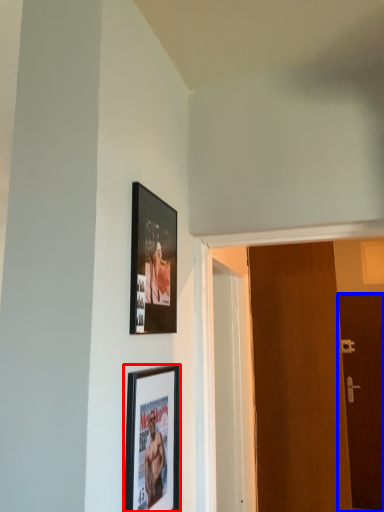
Question: Which of the following is the closest to the observer, picture frame (highlighted by a red box) or door (highlighted by a blue box)?

Choices:
 (A) picture frame
 (B) door

Answer: (A)